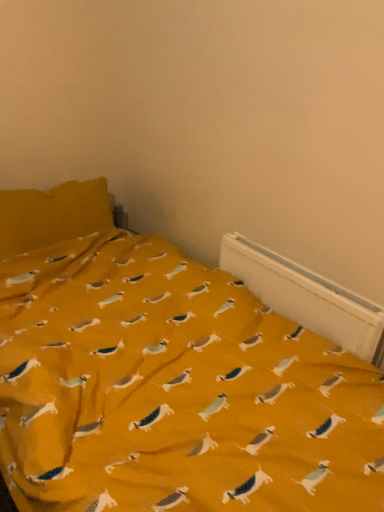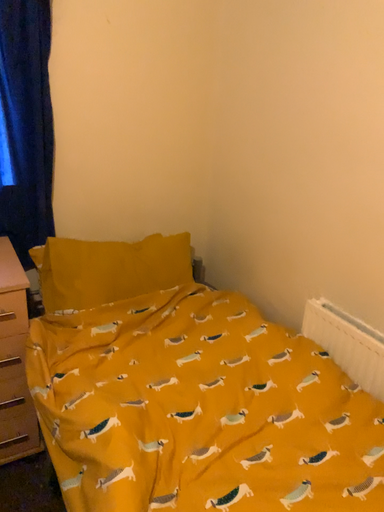
Question: How did the camera likely rotate when shooting the video?

Choices:
 (A) rotated right
 (B) rotated left

Answer: (B)